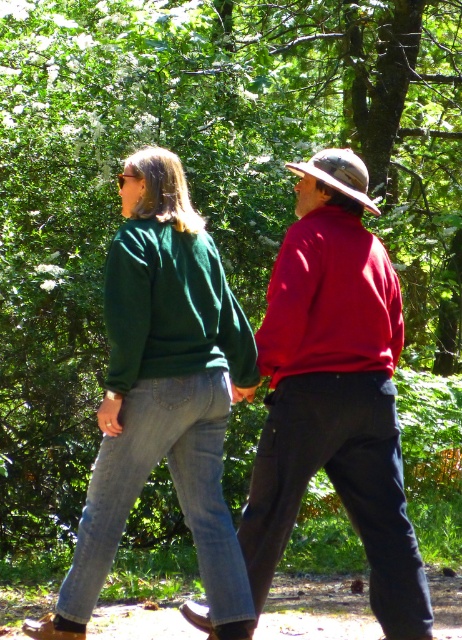
Question: Is matte red sweater at center above green fleece sweater at center?

Choices:
 (A) yes
 (B) no

Answer: (B)

Question: Which point is farther to the camera?

Choices:
 (A) (204, 259)
 (B) (205, 525)

Answer: (A)

Question: Observing the image, what is the correct spatial positioning of matte green sweater at center in reference to green fleece sweater at center?

Choices:
 (A) below
 (B) above

Answer: (A)

Question: Which of the following is the farthest from the observer?

Choices:
 (A) (292, 337)
 (B) (163, 259)

Answer: (B)

Question: Can you confirm if matte red sweater at center is positioned below matte green sweater at center?

Choices:
 (A) no
 (B) yes

Answer: (A)

Question: Which of the following is the farthest from the observer?

Choices:
 (A) (212, 307)
 (B) (261, 561)
 (C) (213, 541)

Answer: (B)